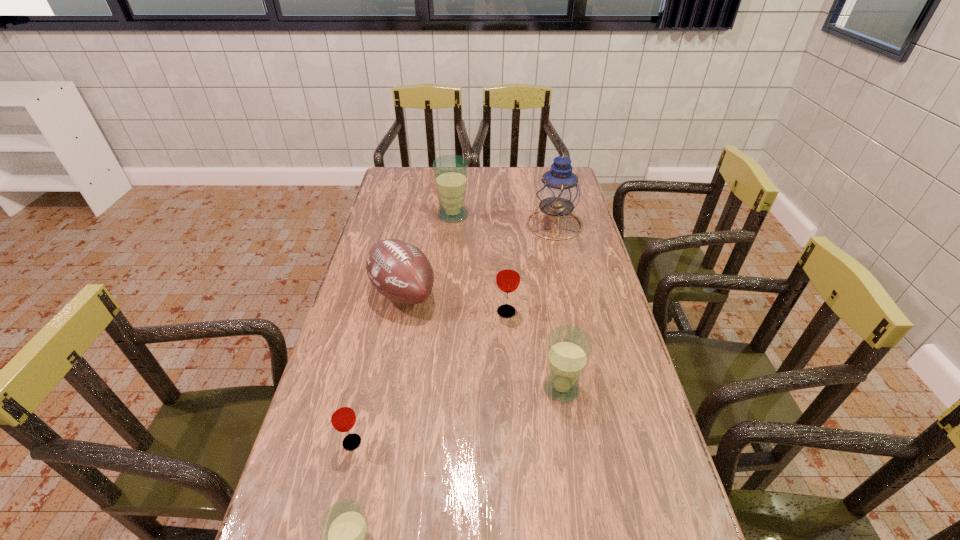
Find the location of `glass that is positioned at the left edge`. glass that is positioned at the left edge is located at coordinates click(342, 416).

At what (x,y) coordinates should I click in order to perform the action: click on lantern situated at the right edge. Please return your answer as a coordinate pair (x, y). The image size is (960, 540). Looking at the image, I should click on (558, 192).

Locate an element on the screen. glass at the right edge is located at coordinates (569, 348).

Find the location of a particular element. Image resolution: width=960 pixels, height=540 pixels. vacant region at the far edge of the desktop is located at coordinates (433, 181).

I want to click on vacant space at the left edge, so click(380, 198).

Locate an element on the screen. The width and height of the screenshot is (960, 540). free space at the right edge is located at coordinates (618, 356).

Image resolution: width=960 pixels, height=540 pixels. What are the coordinates of `free space between the second glass from right to left and the second blue glass from left to right` in the screenshot? It's located at (480, 264).

Where is `free space between the third nearest object and the fourth nearest glass`? free space between the third nearest object and the fourth nearest glass is located at coordinates (534, 350).

At what (x,y) coordinates should I click in order to perform the action: click on unoccupied position between the nearer red glass and the farther red glass. Please return your answer as a coordinate pair (x, y). Looking at the image, I should click on (429, 377).

Identify the location of free point between the second blue glass from right to left and the fourth glass from left to right. (480, 264).